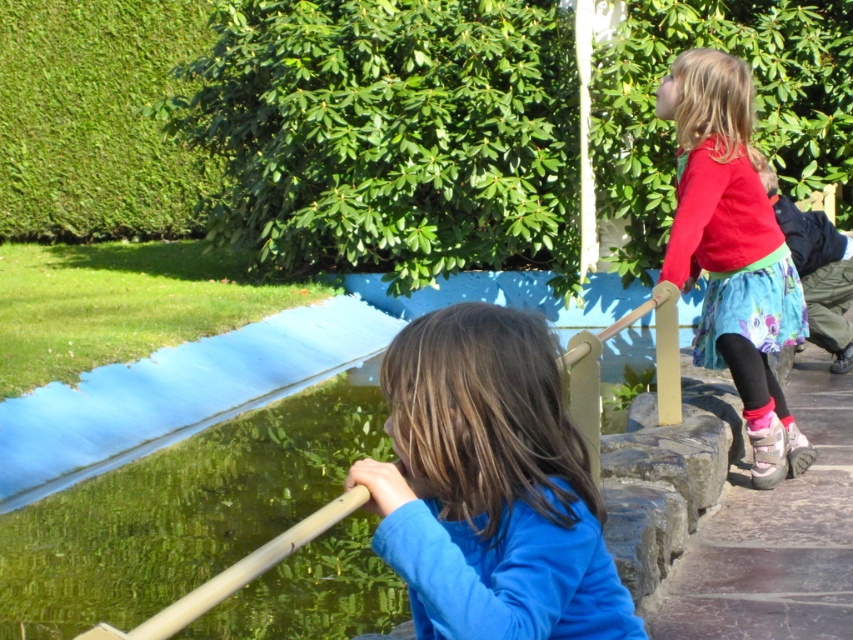
You are a photographer trying to capture both the red cotton shirt at upper right and the green translucent water at center in a single shot. Based on their heights, which object should you focus on first to ensure both are in clear view?

The red cotton shirt at upper right has a greater height compared to green translucent water at center, so you should focus on the red cotton shirt at upper right first to ensure both are in clear view.

You are a photographer trying to capture a photo of both the blue matte shirt at center and the green translucent water at center. Since you want to include both in the frame, which object should you position closer to the left side of your camera viewfinder?

The blue matte shirt at center is positioned on the left side of green translucent water at center, so to include both in the frame, you should position the blue matte shirt at center closer to the left side of your camera viewfinder.